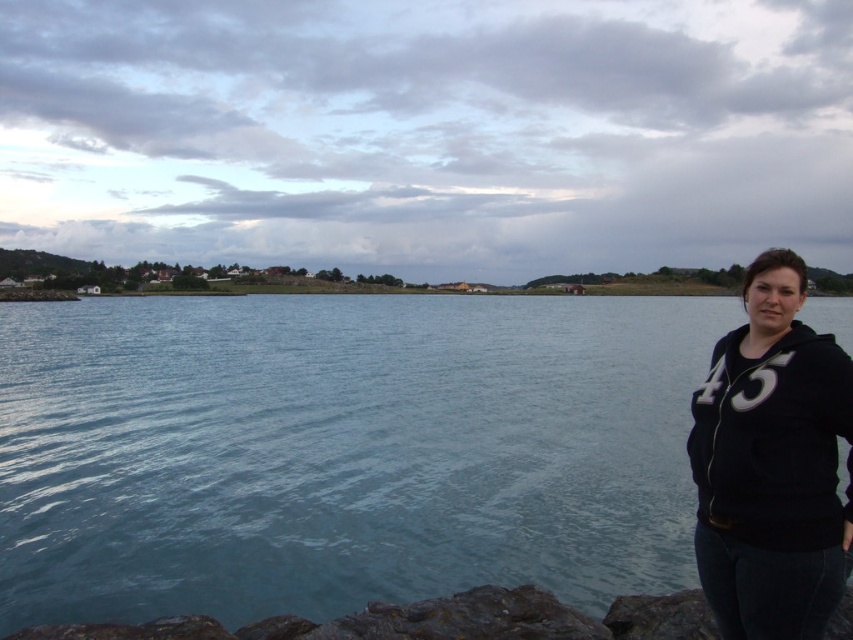
Question: Is black fleece at right to the right of rusty rock at lower left from the viewer's perspective?

Choices:
 (A) no
 (B) yes

Answer: (B)

Question: Which object is positioned farthest from the blue water at center?

Choices:
 (A) black fleece at right
 (B) rusty rock at lower left

Answer: (B)

Question: Is blue water at center wider than rusty rock at lower left?

Choices:
 (A) yes
 (B) no

Answer: (A)

Question: Does black fleece at right appear on the right side of rusty rock at lower left?

Choices:
 (A) yes
 (B) no

Answer: (A)

Question: Which object is the closest to the rusty rock at lower left?

Choices:
 (A) blue water at center
 (B) black fleece at right

Answer: (B)

Question: Which point is closer to the camera?

Choices:
 (A) blue water at center
 (B) black fleece at right
 (C) rusty rock at lower left

Answer: (B)